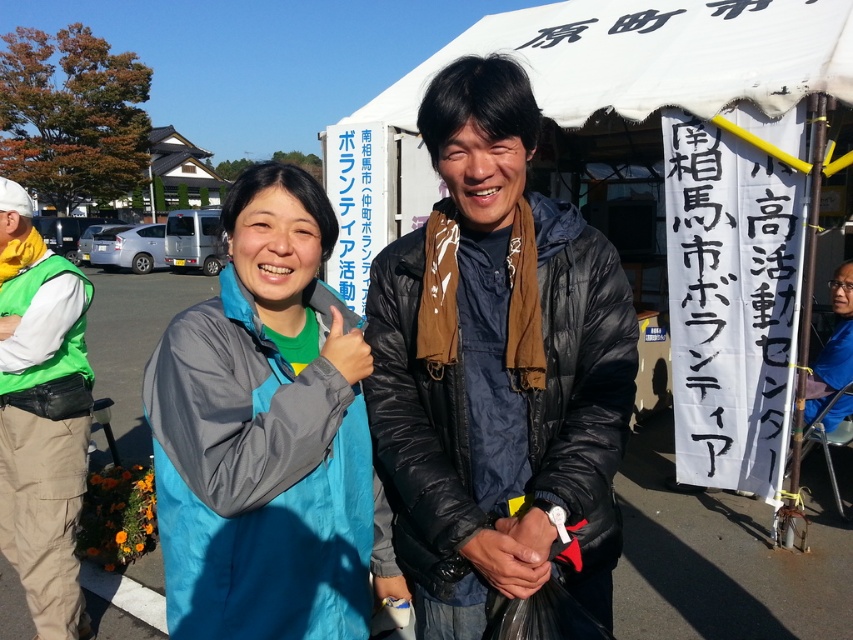
Who is positioned more to the left, white fabric tent at upper center or dark blue jacket at center?

white fabric tent at upper center

Is white fabric tent at upper center positioned before dark blue jacket at center?

Yes, white fabric tent at upper center is in front of dark blue jacket at center.

Identify the location of white fabric tent at upper center. (653, 56).

You are a GUI agent. You are given a task and a screenshot of the screen. Output one action in this format:
    pyautogui.click(x=<x>, y=<y>)
    Task: Click on the white fabric tent at upper center
    
    Given the screenshot: What is the action you would take?
    pyautogui.click(x=653, y=56)

Based on the photo, does black puffy jacket at center have a lesser width compared to white matte vest at left?

No, black puffy jacket at center is not thinner than white matte vest at left.

Who is positioned more to the right, black puffy jacket at center or white matte vest at left?

Positioned to the right is black puffy jacket at center.

The width and height of the screenshot is (853, 640). What are the coordinates of `black puffy jacket at center` in the screenshot? It's located at (497, 369).

Does point (583, 29) come in front of point (55, 305)?

No, (583, 29) is behind (55, 305).

Between point (846, 83) and point (70, 292), which one is positioned in front?

Point (70, 292) is in front.

Find the location of a particular element. Image resolution: width=853 pixels, height=640 pixels. white fabric canopy at upper center is located at coordinates (650, 56).